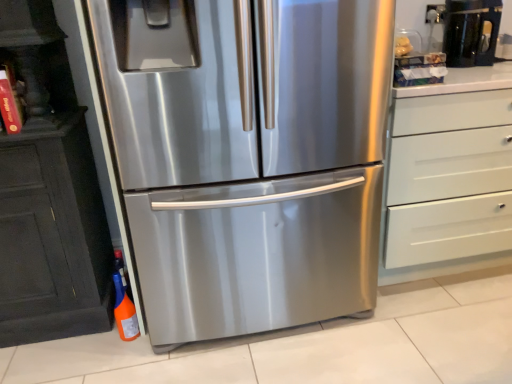
This screenshot has width=512, height=384. I want to click on vacant space situated on the left part of orange matte bottle at lower left, so click(x=88, y=339).